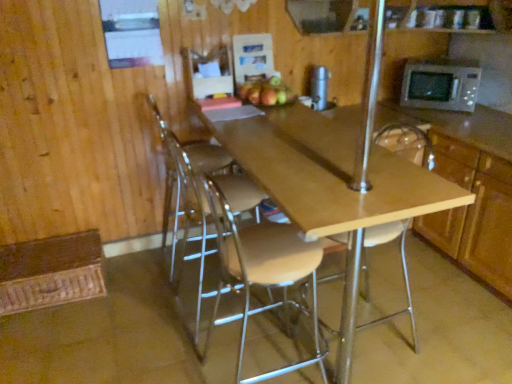
The width and height of the screenshot is (512, 384). Identify the location of free space behind light brown wood stool at center, positioned as the second chair in left-to-right order. (273, 323).